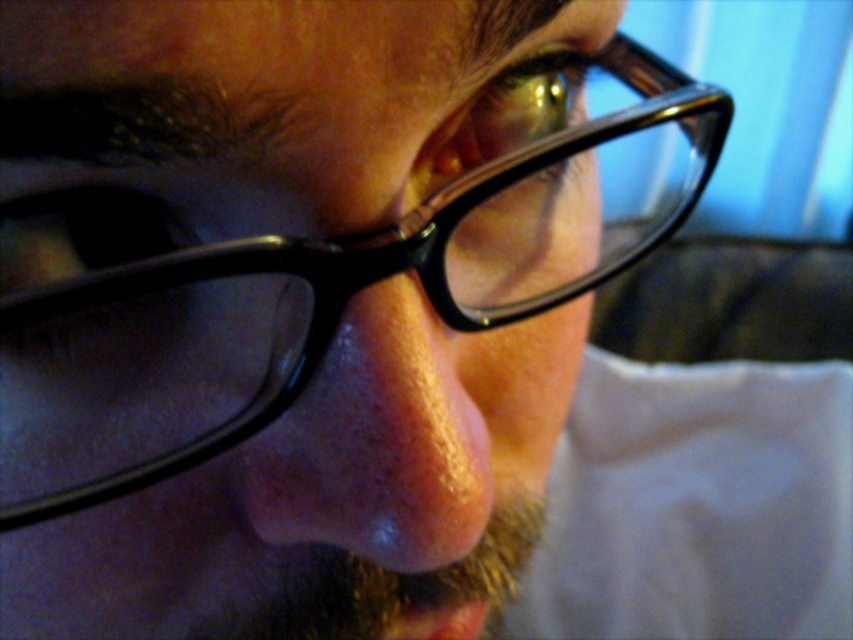
Based on the photo, between black plastic glasses at center and pink matte nose at center, which one has less height?

pink matte nose at center

Which is above, black plastic glasses at center or pink matte nose at center?

black plastic glasses at center

What do you see at coordinates (264, 109) in the screenshot? I see `black plastic glasses at center` at bounding box center [264, 109].

At what (x,y) coordinates should I click in order to perform the action: click on black plastic glasses at center. Please return your answer as a coordinate pair (x, y). Looking at the image, I should click on (264, 109).